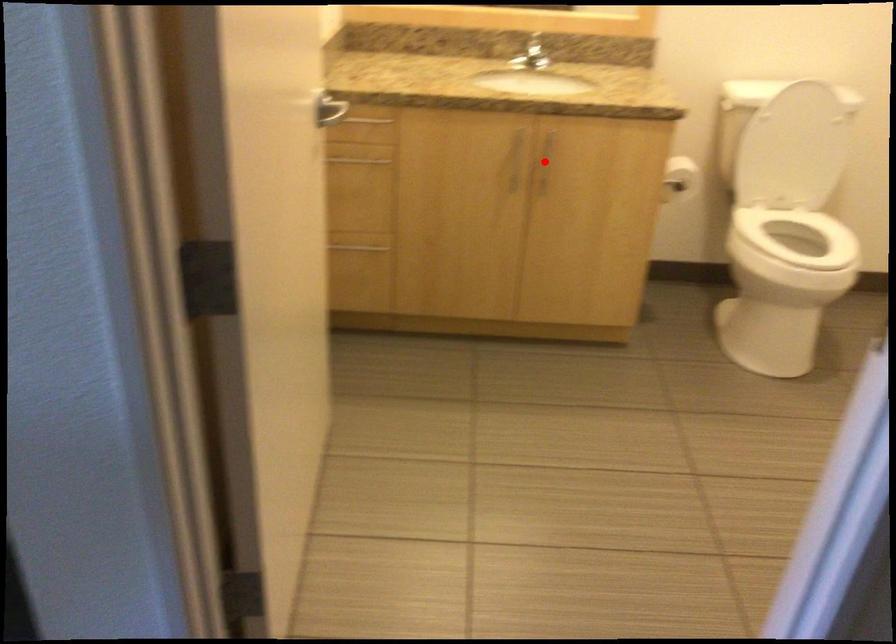
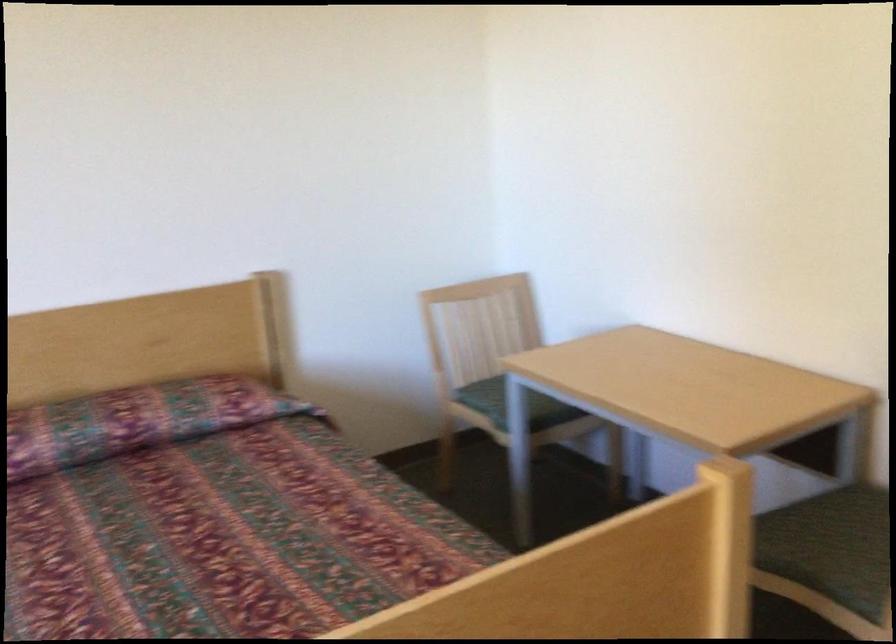
Question: I am providing you with two images of the same scene from different viewpoints. A red point is marked on the first image. Is the red point's position out of view in image 2?

Choices:
 (A) Yes
 (B) No

Answer: (A)